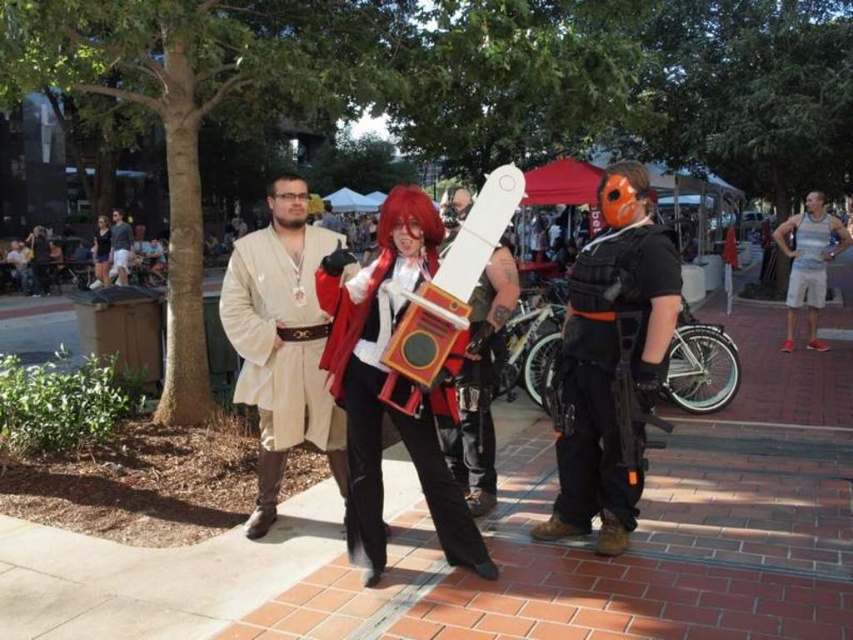
Question: From the image, what is the correct spatial relationship of brick pavement at center in relation to matte red and white sword at center?

Choices:
 (A) above
 (B) below

Answer: (B)

Question: Does white cotton tank top at right come behind light brown leather jacket at upper left?

Choices:
 (A) no
 (B) yes

Answer: (A)

Question: Estimate the real-world distances between objects in this image. Which object is farther from the light brown leather jacket at upper left?

Choices:
 (A) brick pavement at center
 (B) matte black armor at center
 (C) black matte tactical vest at center
 (D) matte black wig at center

Answer: (C)

Question: Is white matte tank top at right positioned in front of matte black wig at center?

Choices:
 (A) yes
 (B) no

Answer: (A)

Question: Which of the following is the closest to the observer?

Choices:
 (A) (438, 337)
 (B) (97, 285)
 (C) (845, 464)

Answer: (A)

Question: Based on their relative distances, which object is nearer to the matte black armor at center?

Choices:
 (A) matte red and white sword at center
 (B) matte red and white costume at center
 (C) light brown leather jacket at upper left

Answer: (B)